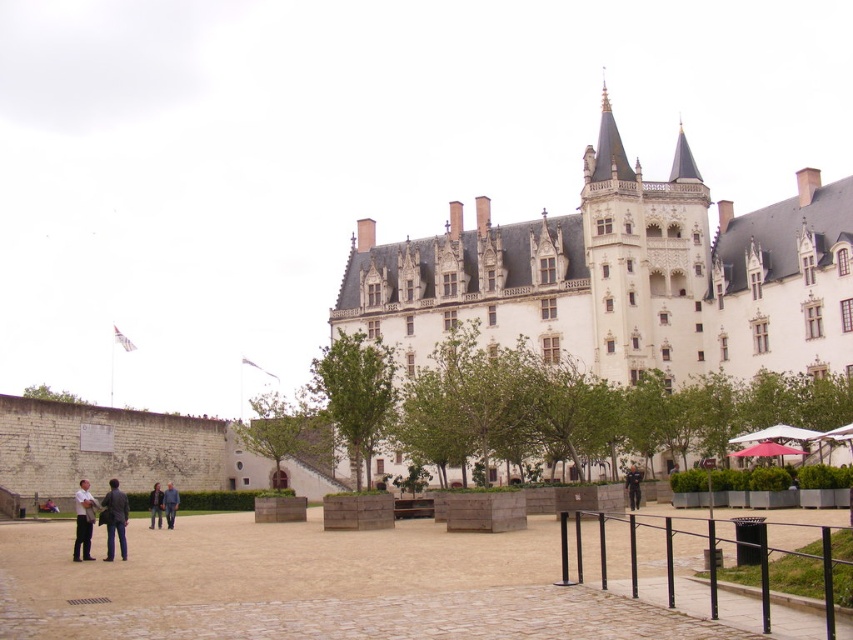
Question: Is brown stone plaza at center wider than dark blue jeans at center?

Choices:
 (A) yes
 (B) no

Answer: (A)

Question: Does brown stone plaza at center have a greater width compared to light gray fabric jacket at lower left?

Choices:
 (A) yes
 (B) no

Answer: (A)

Question: Does light gray fabric jacket at lower left appear over dark blue jeans at center?

Choices:
 (A) yes
 (B) no

Answer: (A)

Question: Which is nearer to the brown stone plaza at center?

Choices:
 (A) dark gray jacket at lower left
 (B) white stone castle at center

Answer: (A)

Question: Which point is farther to the camera?

Choices:
 (A) (158, 518)
 (B) (115, 524)

Answer: (A)

Question: Among these points, which one is farthest from the camera?

Choices:
 (A) (90, 502)
 (B) (149, 497)

Answer: (B)